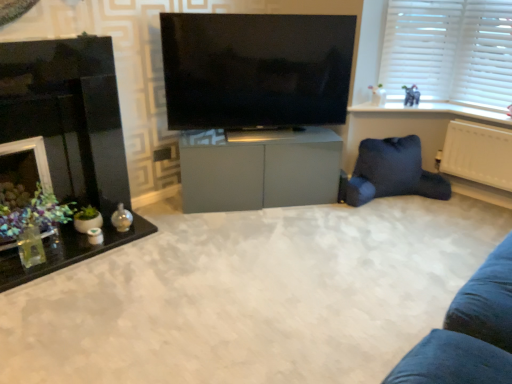
The width and height of the screenshot is (512, 384). What are the coordinates of `vacant area in front of dark blue fabric bean bag at lower right` in the screenshot? It's located at (408, 230).